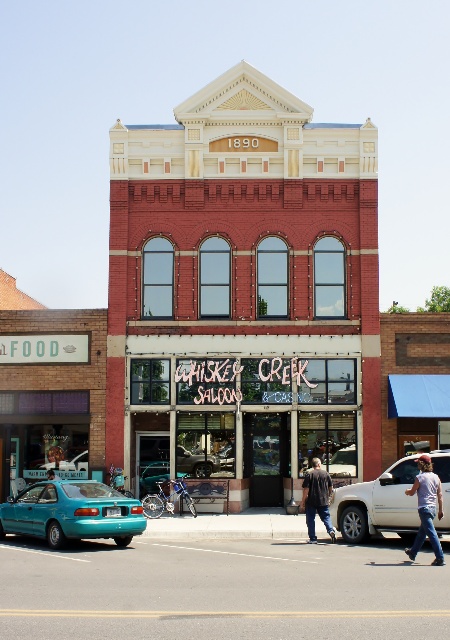
You are a delivery person needing to unload a package from the white matte truck at center. The package is too heavy to lift over the truck bed. There is a ramp available. To avoid damaging the package, you need to place it on the ground near the denim jeans at lower right. Can you safely move the package from the truck bed to the ground without lifting it, using the ramp?

The white matte truck at center is positioned under denim jeans at lower right, so yes, you can safely move the package from the white matte truck at center to the ground near the denim jeans at lower right using the ramp without lifting it.